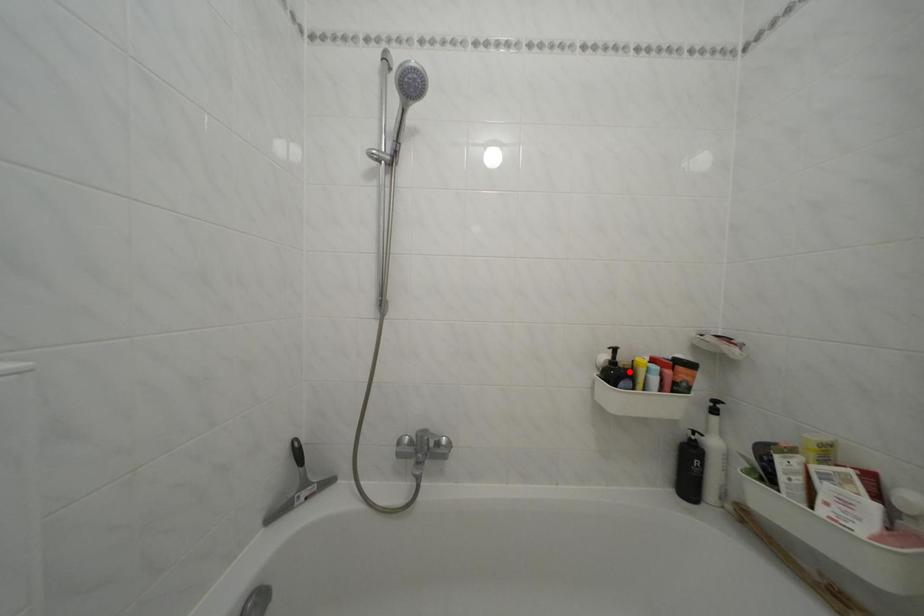
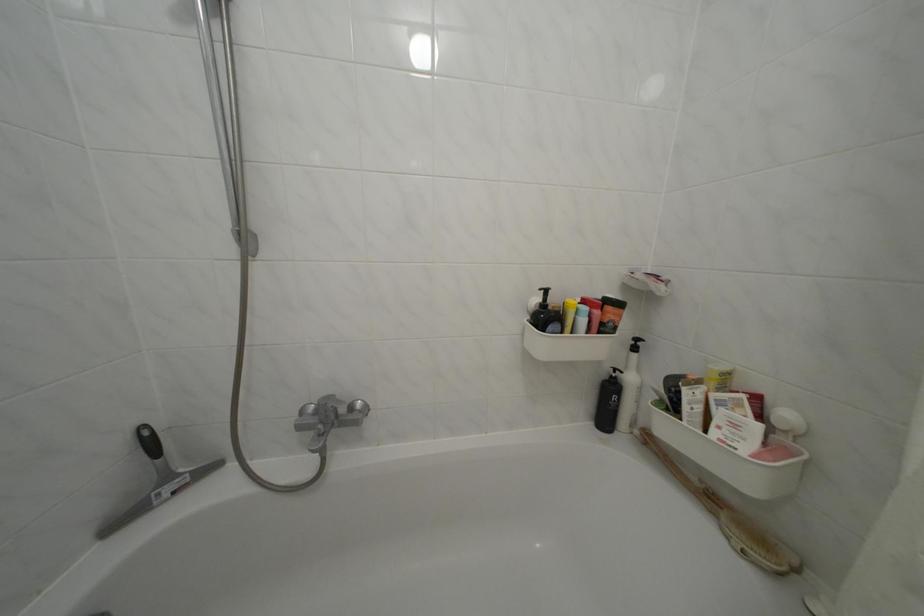
The point at the highlighted location is marked in the first image. Where is the corresponding point in the second image?

(560, 314)